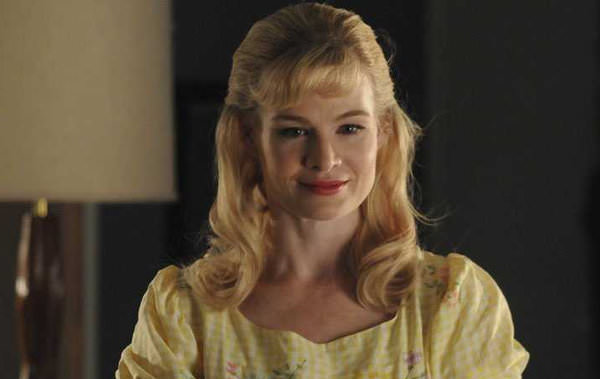
What are the coordinates of `blurred chair top` in the screenshot? It's located at (43, 290).